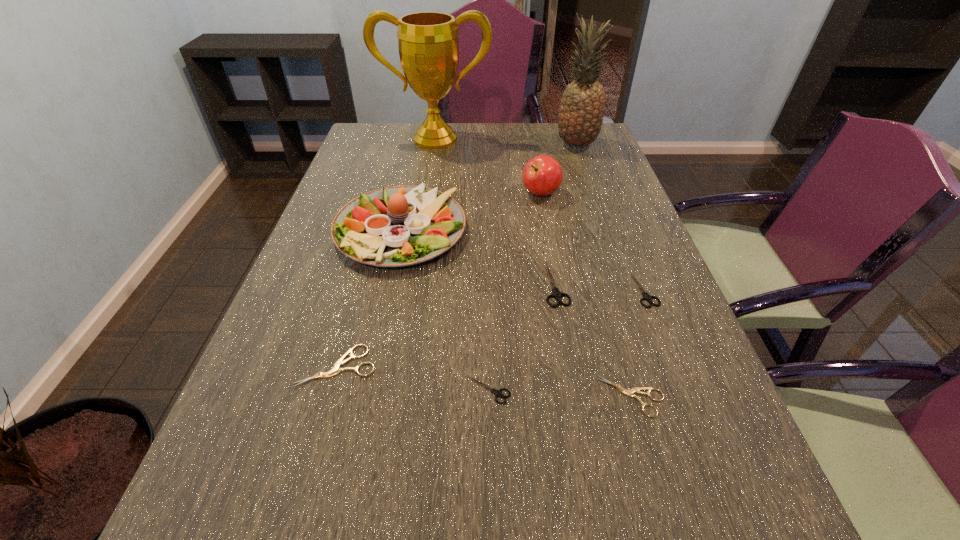
Find the location of a particular element. the right beige shears is located at coordinates (630, 392).

Locate an element on the screen. Image resolution: width=960 pixels, height=540 pixels. the fourth shears from left to right is located at coordinates (630, 392).

Image resolution: width=960 pixels, height=540 pixels. In order to click on the second shears from left to right in this screenshot , I will do `click(498, 393)`.

Image resolution: width=960 pixels, height=540 pixels. Find the location of `the smallest black shears`. the smallest black shears is located at coordinates (498, 393).

Where is `vacant region located on the front-facing side of the gold award`? vacant region located on the front-facing side of the gold award is located at coordinates (431, 168).

This screenshot has width=960, height=540. What are the coordinates of `free space located 0.340m on the front of the pineapple` in the screenshot? It's located at (600, 214).

At what (x,y) coordinates should I click in order to perform the action: click on free space located on the left of the apple. Please return your answer as a coordinate pair (x, y). The height and width of the screenshot is (540, 960). Looking at the image, I should click on (501, 193).

Find the location of `free location located on the right of the salad plate`. free location located on the right of the salad plate is located at coordinates (564, 231).

Identify the location of free space located on the left of the biggest black shears. This screenshot has height=540, width=960. (372, 284).

Identify the location of free region located 0.180m on the back of the second smallest black shears. The width and height of the screenshot is (960, 540). (620, 226).